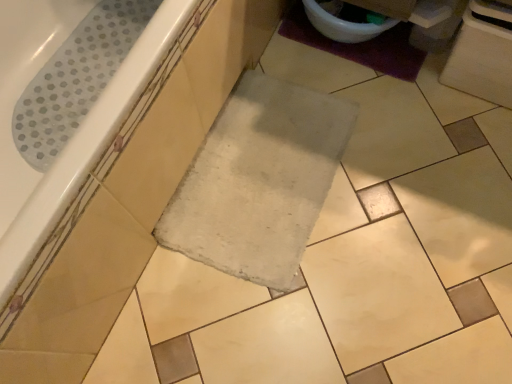
The width and height of the screenshot is (512, 384). I want to click on vacant space situated above purple fuzzy bath mat at upper right (from a real-world perspective), so click(x=344, y=41).